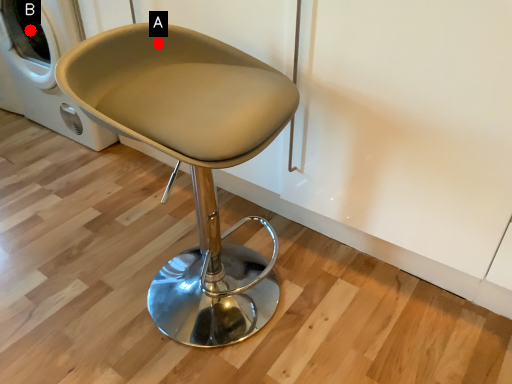
Question: Two points are circled on the image, labeled by A and B beside each circle. Among these points, which one is farthest from the camera?

Choices:
 (A) A is further
 (B) B is further

Answer: (B)